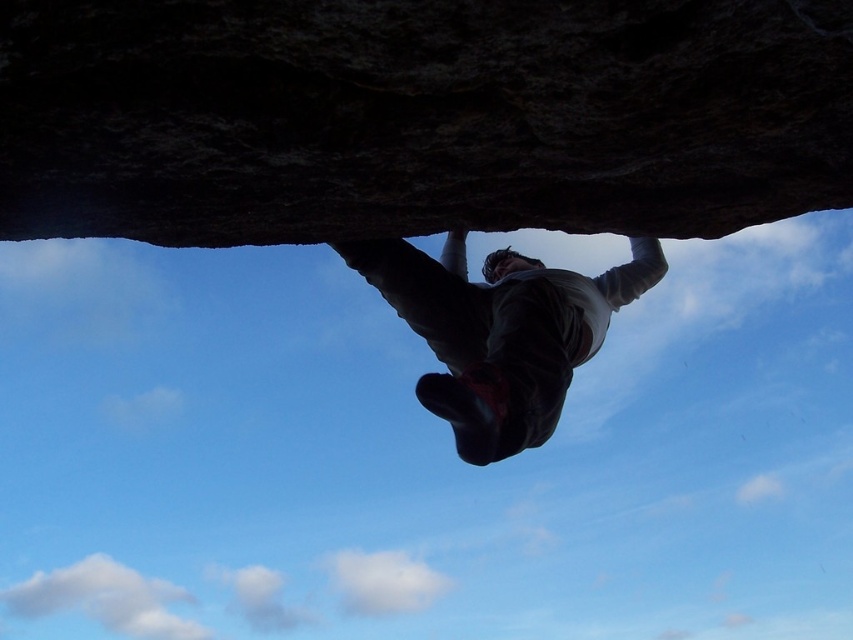
Question: Which point is closer to the camera?

Choices:
 (A) (476, 403)
 (B) (614, 60)

Answer: (B)

Question: Does dark rock cliff at upper center appear on the right side of dark gray fabric climbing harness at center?

Choices:
 (A) no
 (B) yes

Answer: (A)

Question: Can you confirm if dark rock cliff at upper center is positioned to the left of dark gray fabric climbing harness at center?

Choices:
 (A) yes
 (B) no

Answer: (A)

Question: Which of the following is the farthest from the observer?

Choices:
 (A) (459, 330)
 (B) (277, 68)

Answer: (A)

Question: Can you confirm if dark rock cliff at upper center is positioned above dark gray fabric climbing harness at center?

Choices:
 (A) yes
 (B) no

Answer: (A)